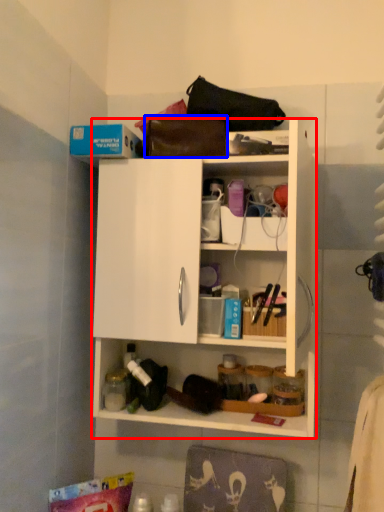
Question: Which point is closer to the camera, cabinetry (highlighted by a red box) or handbag (highlighted by a blue box)?

Choices:
 (A) cabinetry
 (B) handbag

Answer: (A)